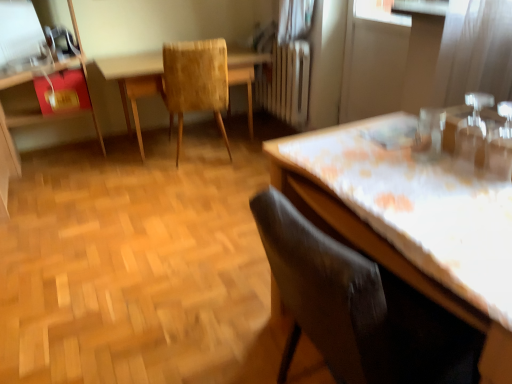
The height and width of the screenshot is (384, 512). Identify the location of vacant area that lies in front of wooden textured table at center. (172, 196).